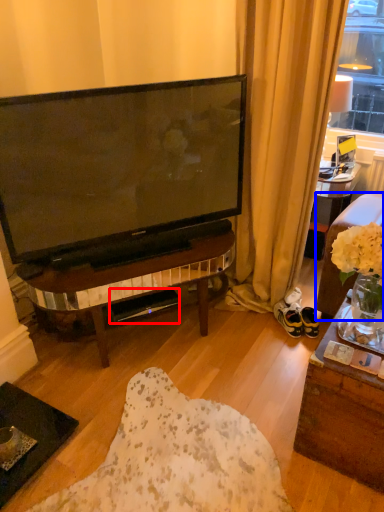
Question: Which object appears farthest to the camera in this image, loudspeaker (highlighted by a red box) or studio couch (highlighted by a blue box)?

Choices:
 (A) loudspeaker
 (B) studio couch

Answer: (A)